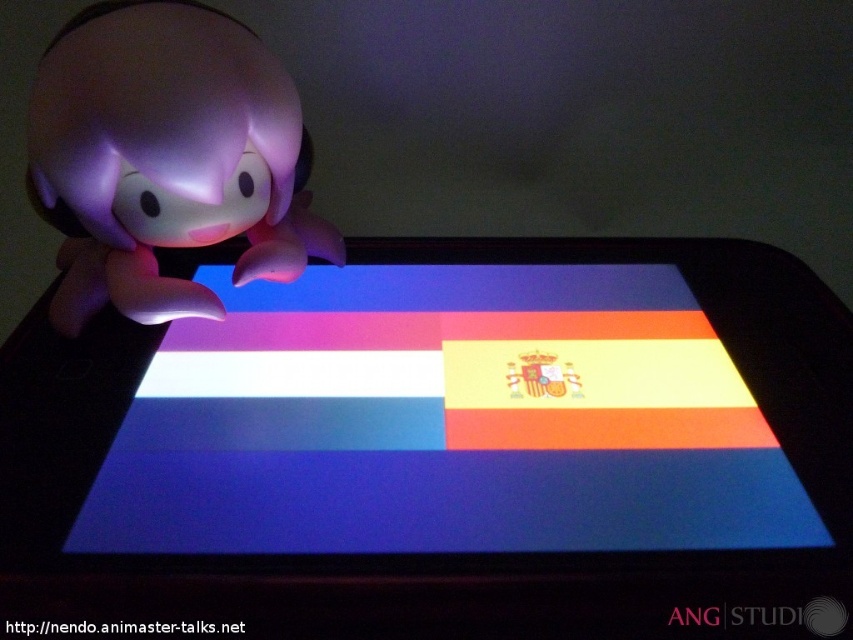
Question: Does matte plastic screen at center come behind pink matte toy at left?

Choices:
 (A) no
 (B) yes

Answer: (A)

Question: From the image, what is the correct spatial relationship of matte plastic screen at center in relation to pink matte toy at left?

Choices:
 (A) left
 (B) right

Answer: (B)

Question: Among these points, which one is farthest from the camera?

Choices:
 (A) (352, 378)
 (B) (141, 104)

Answer: (A)

Question: Can you confirm if matte plastic screen at center is smaller than pink matte toy at left?

Choices:
 (A) yes
 (B) no

Answer: (B)